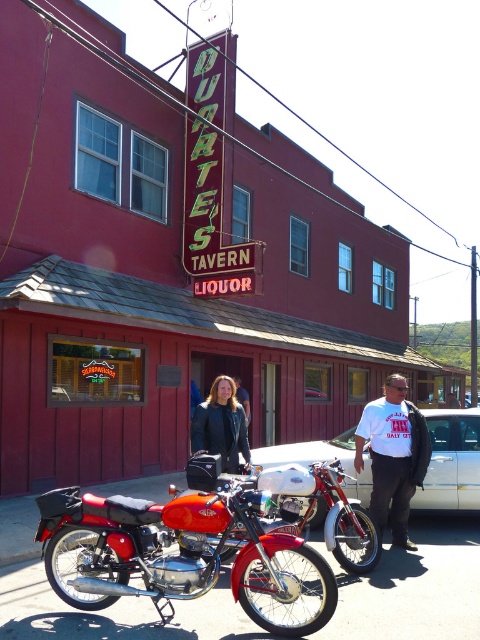
Question: Can you confirm if shiny red motorcycle at center is smaller than leather jacket at center?

Choices:
 (A) no
 (B) yes

Answer: (A)

Question: Which object is the farthest from the silver metallic car at center?

Choices:
 (A) shiny chrome motorcycle at center
 (B) white cotton t-shirt at center
 (C) shiny red motorcycle at center

Answer: (C)

Question: Which is nearer to the silver metallic car at center?

Choices:
 (A) white cotton t-shirt at center
 (B) shiny chrome motorcycle at center

Answer: (A)

Question: Is the position of shiny red motorcycle at center more distant than that of shiny chrome motorcycle at center?

Choices:
 (A) no
 (B) yes

Answer: (A)

Question: Which point is closer to the camera?

Choices:
 (A) 228,467
 (B) 405,490

Answer: (A)

Question: Does white cotton t-shirt at center have a greater width compared to leather jacket at center?

Choices:
 (A) yes
 (B) no

Answer: (A)